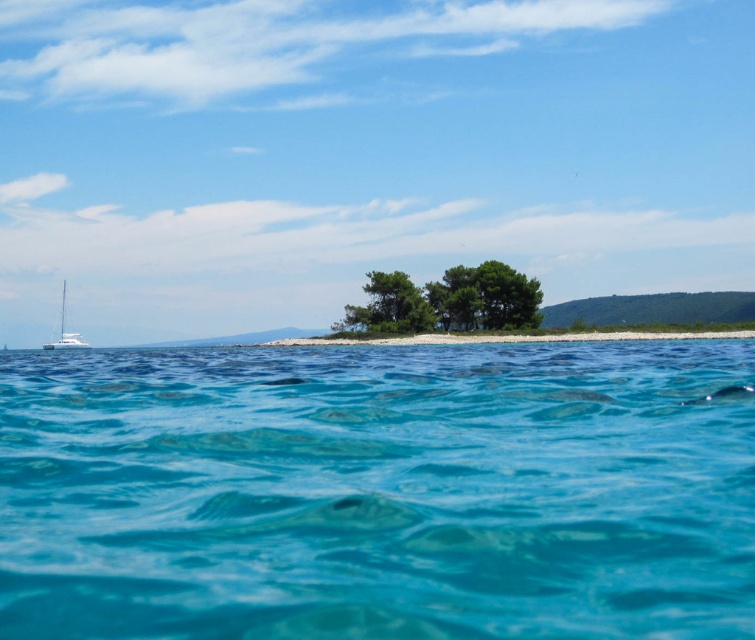
Can you confirm if green leafy tree at center is positioned above white glossy sailboat at left?

Yes.

Which is more to the right, green leafy tree at center or white glossy sailboat at left?

Positioned to the right is green leafy tree at center.

The height and width of the screenshot is (640, 755). What do you see at coordinates (390, 307) in the screenshot?
I see `green leafy tree at center` at bounding box center [390, 307].

I want to click on green leafy tree at center, so click(x=390, y=307).

Between clear blue water at center and green leafy tree at center, which one appears on the right side from the viewer's perspective?

clear blue water at center

Who is more forward, (633,477) or (424,296)?

Point (633,477)

Describe the element at coordinates (378, 492) in the screenshot. I see `clear blue water at center` at that location.

Locate an element on the screen. This screenshot has width=755, height=640. clear blue water at center is located at coordinates (x=378, y=492).

Measure the distance from green leafy trees at center to white glossy sailboat at left.

249.65 feet

Who is lower down, green leafy trees at center or white glossy sailboat at left?

white glossy sailboat at left

Is point (485, 266) in front of point (66, 344)?

Yes, it is in front of point (66, 344).

Identify the location of green leafy trees at center. The image size is (755, 640). (447, 301).